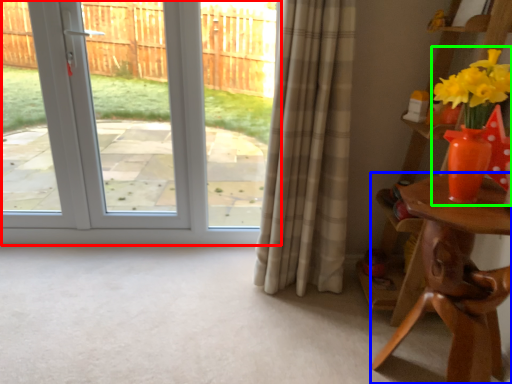
Question: Considering the real-world distances, which object is closest to door (highlighted by a red box)? table (highlighted by a blue box) or floral arrangement (highlighted by a green box).

Choices:
 (A) table
 (B) floral arrangement

Answer: (A)